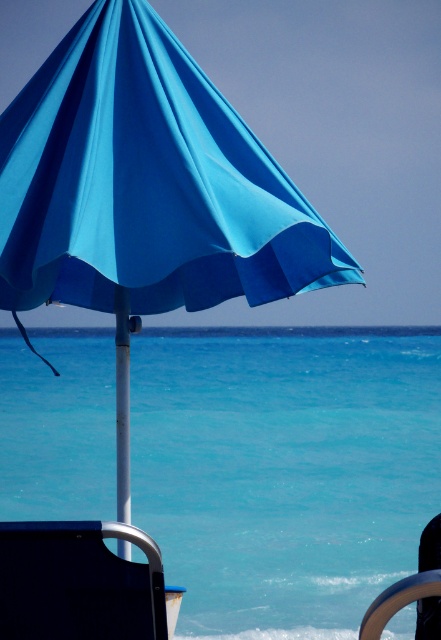
Question: Can you confirm if turquoise water at center is bigger than blue fabric umbrella at upper center?

Choices:
 (A) no
 (B) yes

Answer: (B)

Question: Does turquoise water at center have a larger size compared to metallic silver ring at lower right?

Choices:
 (A) yes
 (B) no

Answer: (A)

Question: Can you confirm if dark blue fabric beach chair at lower left is bigger than metallic silver ring at lower right?

Choices:
 (A) yes
 (B) no

Answer: (A)

Question: Which of these objects is positioned closest to the turquoise water at center?

Choices:
 (A) dark blue fabric beach chair at lower left
 (B) metallic silver ring at lower right
 (C) blue fabric umbrella at upper center

Answer: (C)

Question: Among these points, which one is farthest from the camera?

Choices:
 (A) (37, 589)
 (B) (159, 461)

Answer: (B)

Question: Which point appears farthest from the camera in this image?

Choices:
 (A) (391, 616)
 (B) (25, 536)
 (C) (26, 492)
 (D) (11, 164)

Answer: (C)